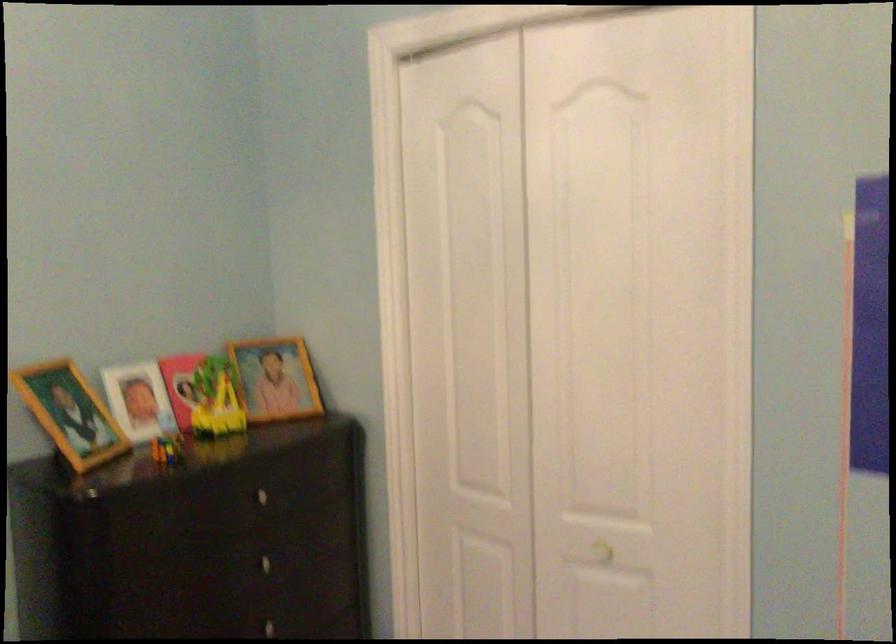
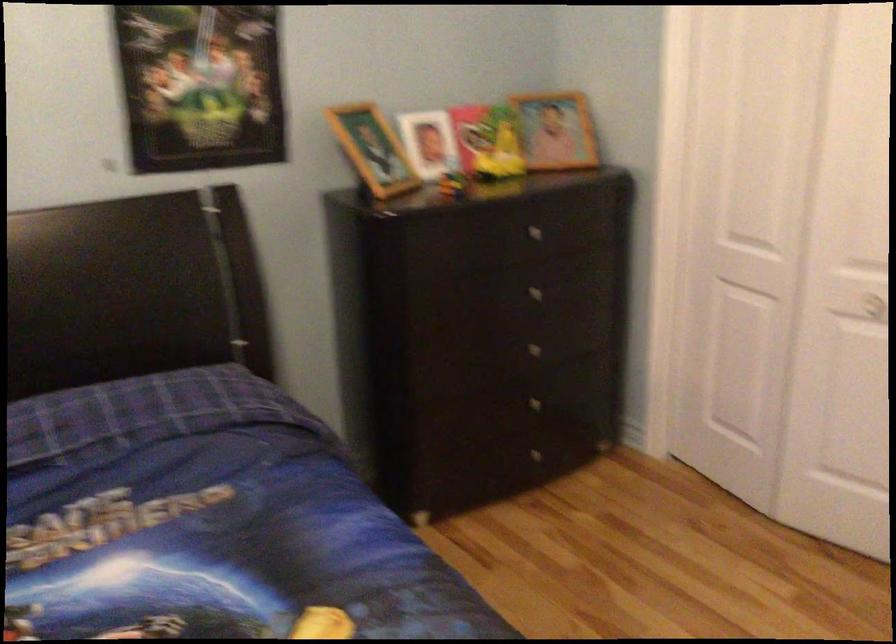
The point at [280,380] is marked in the first image. Where is the corresponding point in the second image?

(556, 129)